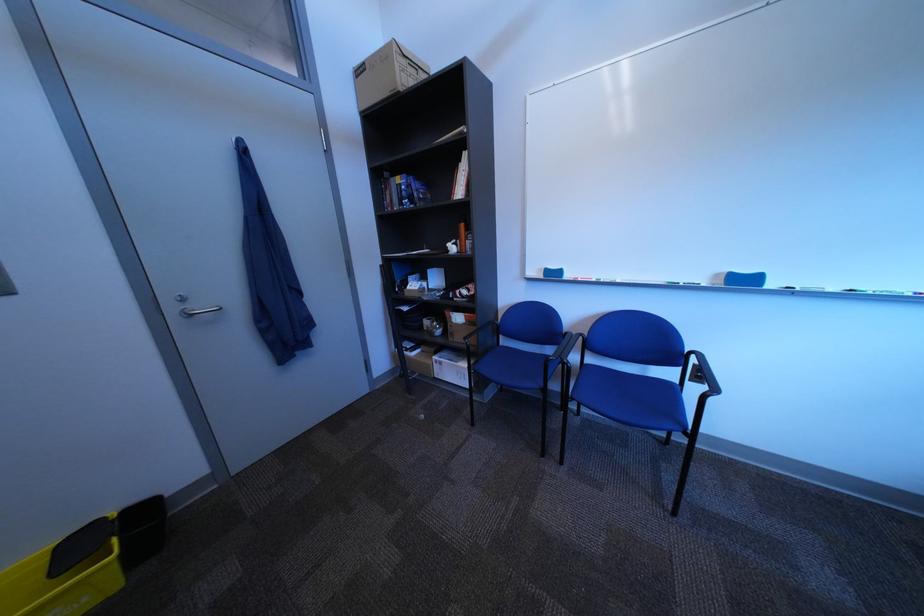
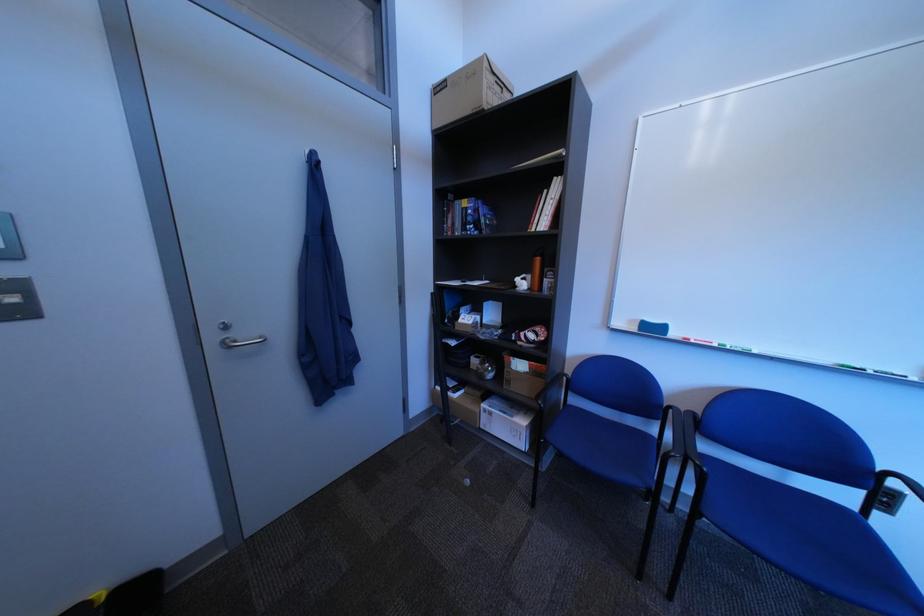
Where in the second image is the point corresponding to [451,254] from the first image?

(517, 290)